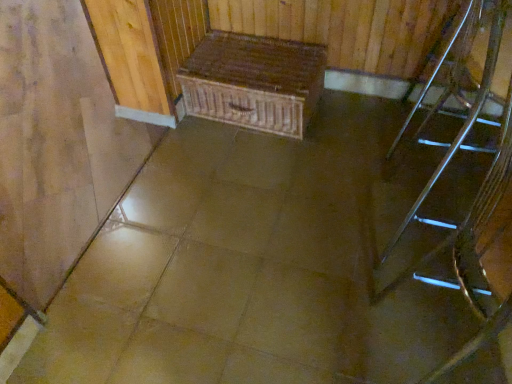
The width and height of the screenshot is (512, 384). In order to click on space that is in front of wooden chest at center in this screenshot , I will do 260,178.